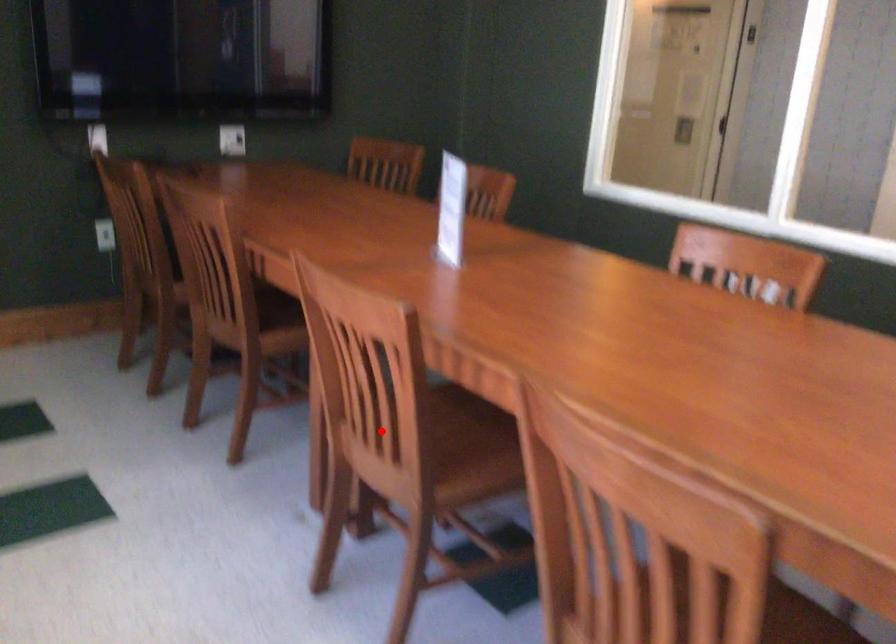
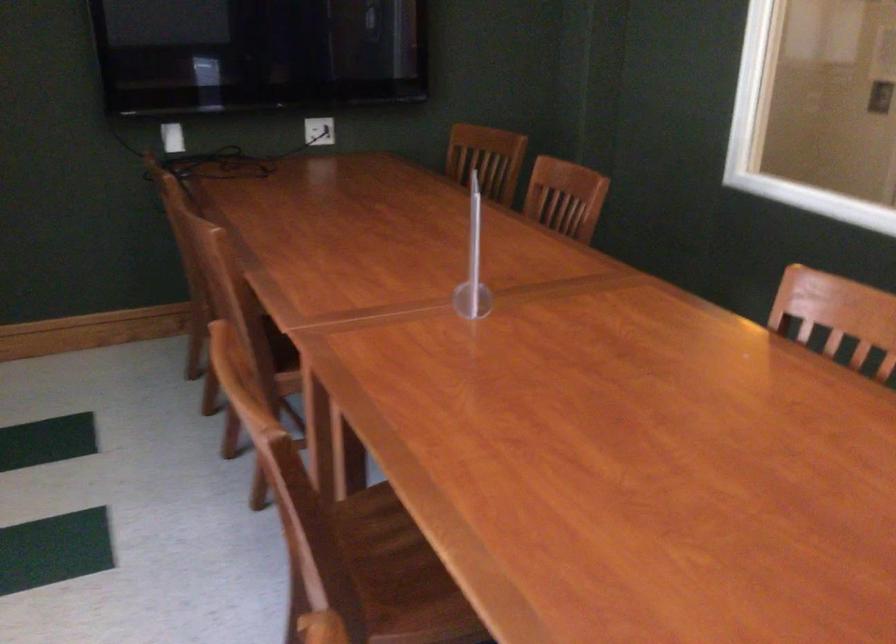
Find the pixel in the second image that matches the highlighted location in the first image.

(341, 529)